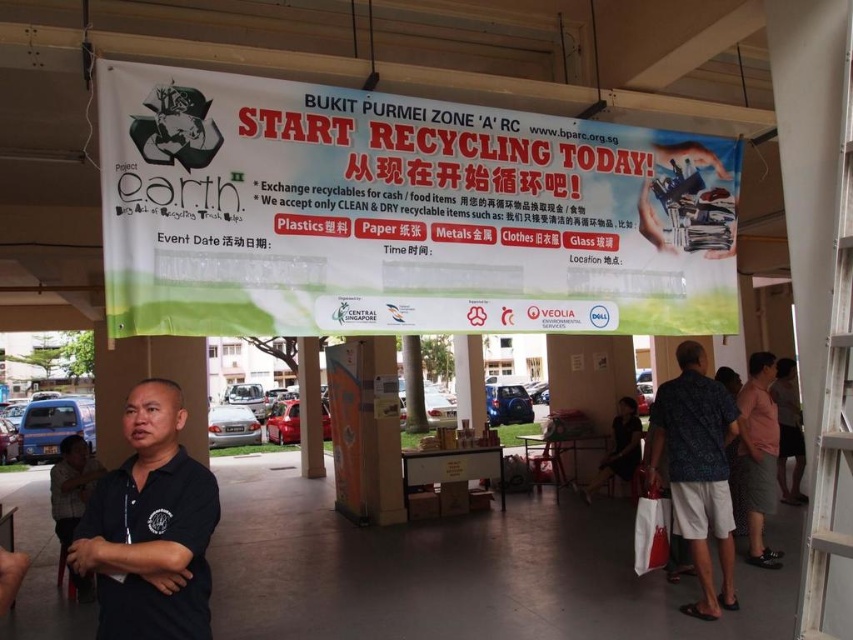
Is black matte shirt at center thinner than pink cotton shirt at right?

Correct, black matte shirt at center's width is less than pink cotton shirt at right's.

The image size is (853, 640). I want to click on black matte shirt at center, so click(149, 528).

Is white paper banner at upper center thinner than dark gray shirt at lower left?

In fact, white paper banner at upper center might be wider than dark gray shirt at lower left.

Describe the element at coordinates (399, 214) in the screenshot. I see `white paper banner at upper center` at that location.

Is point (136, 248) closer to camera compared to point (57, 500)?

Yes, it is.

Where is `white paper banner at upper center`? The width and height of the screenshot is (853, 640). white paper banner at upper center is located at coordinates (399, 214).

Does point (190, 518) come behind point (779, 461)?

That is False.

Which of these two, black matte shirt at center or pink fabric at right, stands taller?

pink fabric at right

This screenshot has width=853, height=640. What do you see at coordinates (149, 528) in the screenshot? I see `black matte shirt at center` at bounding box center [149, 528].

This screenshot has height=640, width=853. I want to click on black matte shirt at center, so pyautogui.click(x=149, y=528).